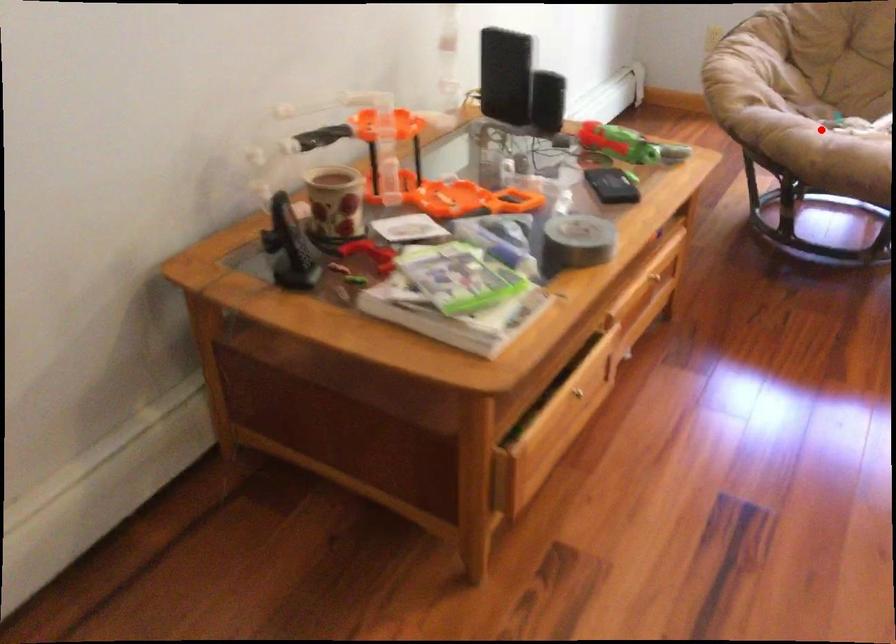
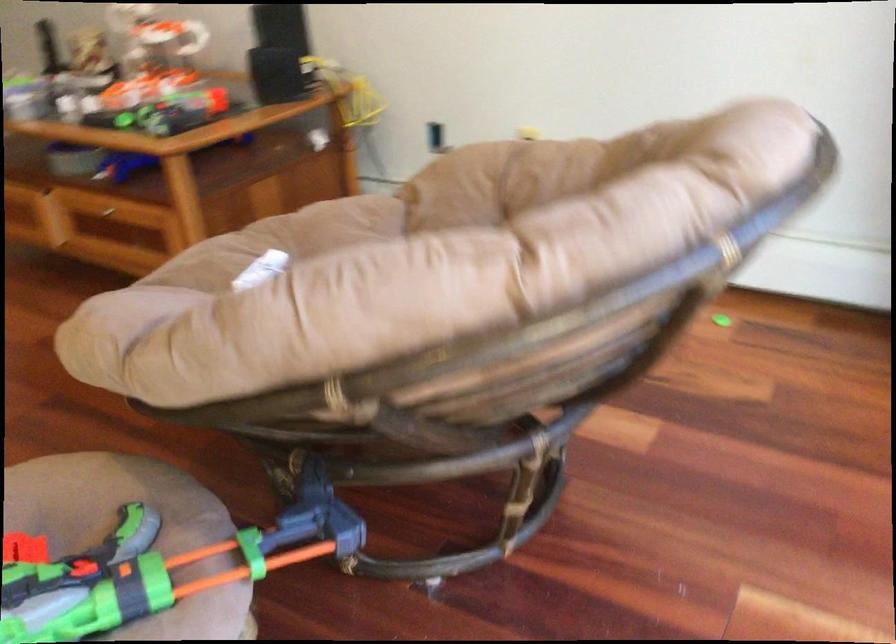
Find the pixel in the second image that matches the highlighted location in the first image.

(281, 241)